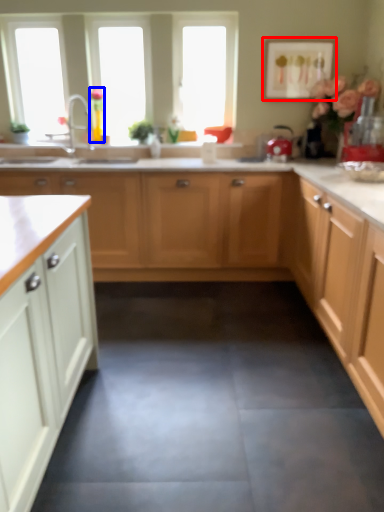
Question: Which of the following is the closest to the observer, picture frame (highlighted by a red box) or flower (highlighted by a blue box)?

Choices:
 (A) picture frame
 (B) flower

Answer: (A)